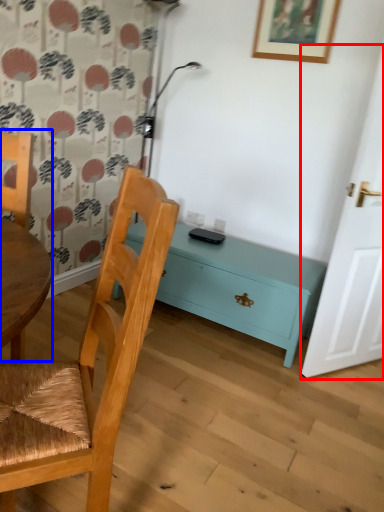
Question: Which point is closer to the camera, door (highlighted by a red box) or chair (highlighted by a blue box)?

Choices:
 (A) door
 (B) chair

Answer: (B)